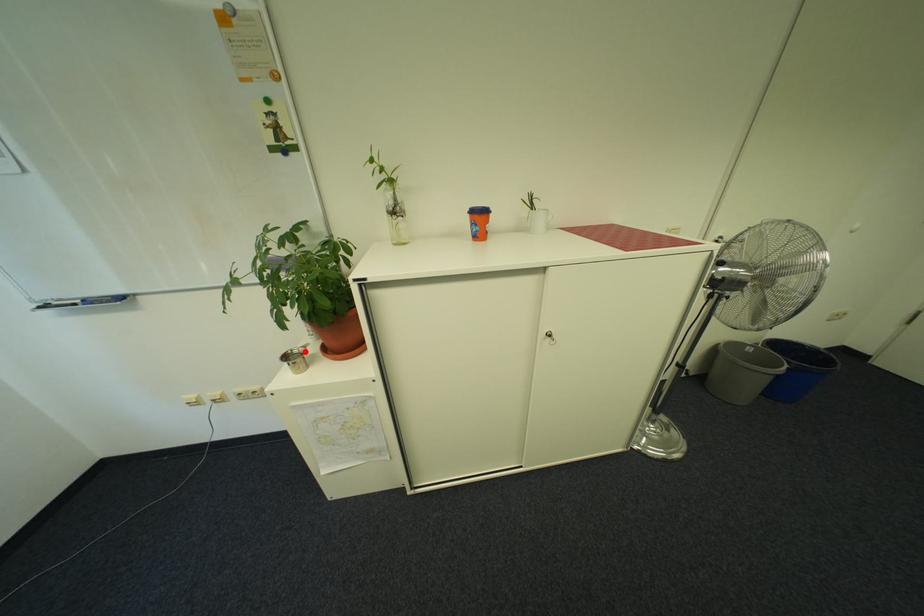
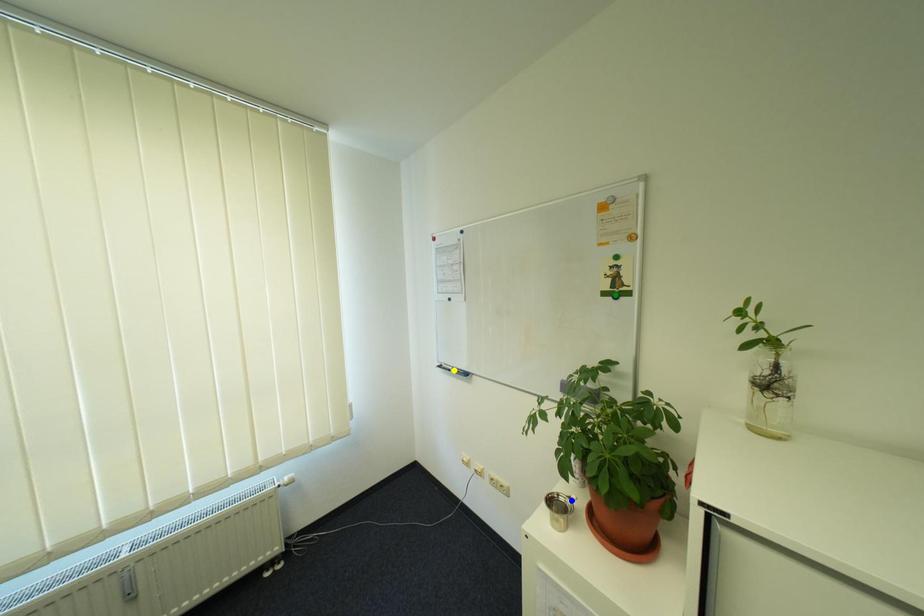
Question: I am providing you with two images of the same scene from different viewpoints. A red point is marked on the first image. You are given multiple points on the second image. Can you choose the point in image 2 that corresponds to the point in image 1?

Choices:
 (A) blue point
 (B) green point
 (C) yellow point

Answer: (A)